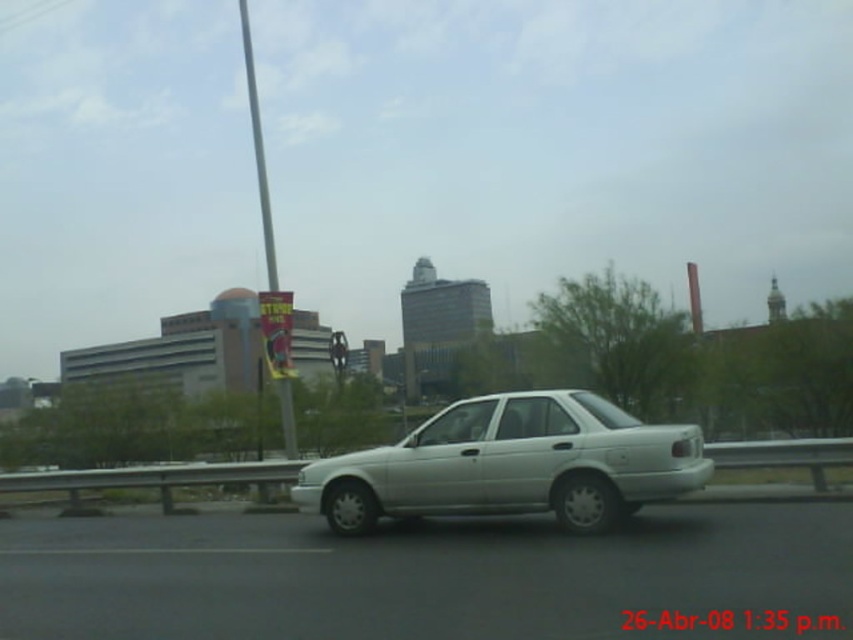
Can you confirm if white metallic car at center is positioned to the left of white matte sedan at center?

Indeed, white metallic car at center is positioned on the left side of white matte sedan at center.

The height and width of the screenshot is (640, 853). I want to click on white metallic car at center, so click(x=415, y=573).

This screenshot has width=853, height=640. I want to click on white metallic car at center, so click(415, 573).

Which is in front, point (666, 508) or point (252, 84)?

Point (666, 508) is in front.

Between white metallic car at center and metallic pole at center, which one appears on the right side from the viewer's perspective?

white metallic car at center is more to the right.

Is point (141, 605) less distant than point (289, 403)?

Yes, point (141, 605) is in front of point (289, 403).

Locate an element on the screen. This screenshot has height=640, width=853. white metallic car at center is located at coordinates (415, 573).

Who is taller, white matte sedan at center or metallic pole at center?

metallic pole at center is taller.

Where is `white matte sedan at center`? white matte sedan at center is located at coordinates (511, 465).